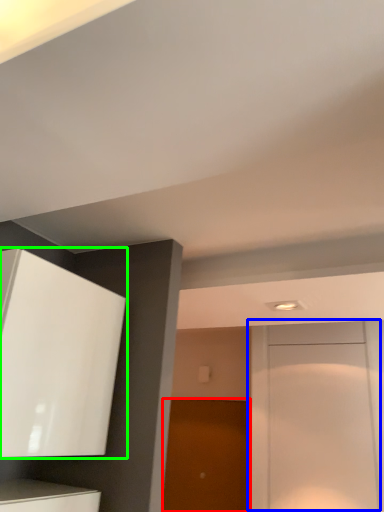
Question: Considering the real-world distances, which object is farthest from door (highlighted by a red box)? door (highlighted by a blue box) or cabinetry (highlighted by a green box)?

Choices:
 (A) door
 (B) cabinetry

Answer: (B)